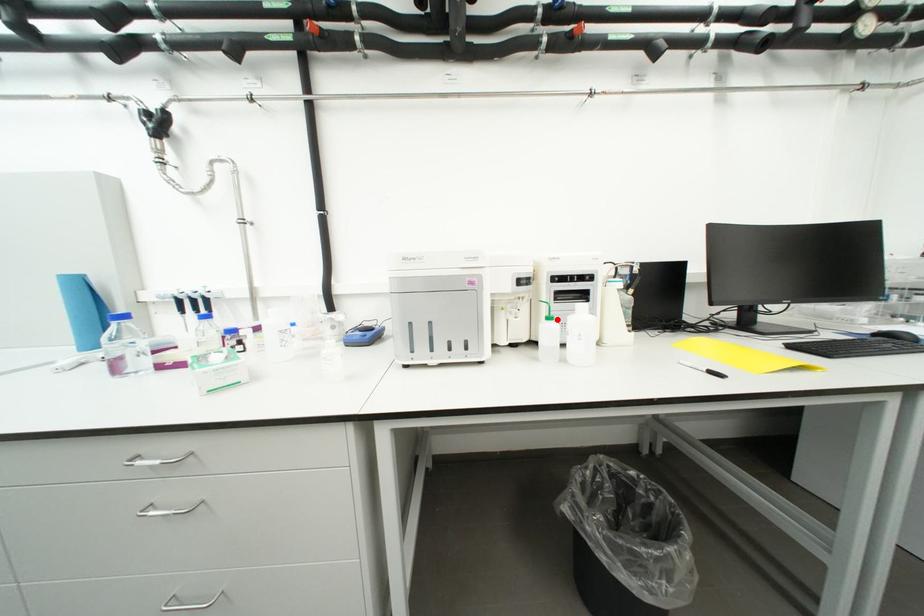
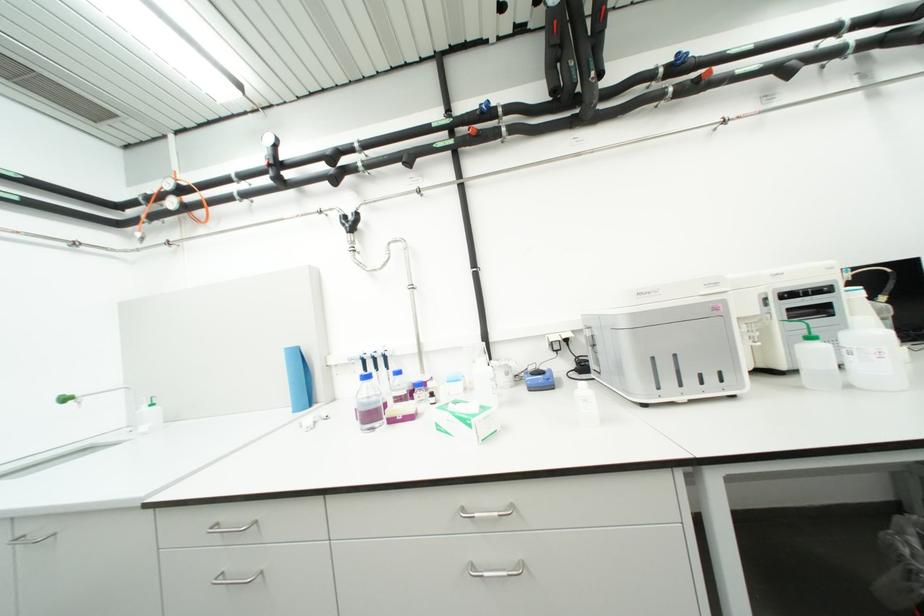
Locate, in the second image, the point that corresponds to the highlighted location in the first image.

(819, 339)